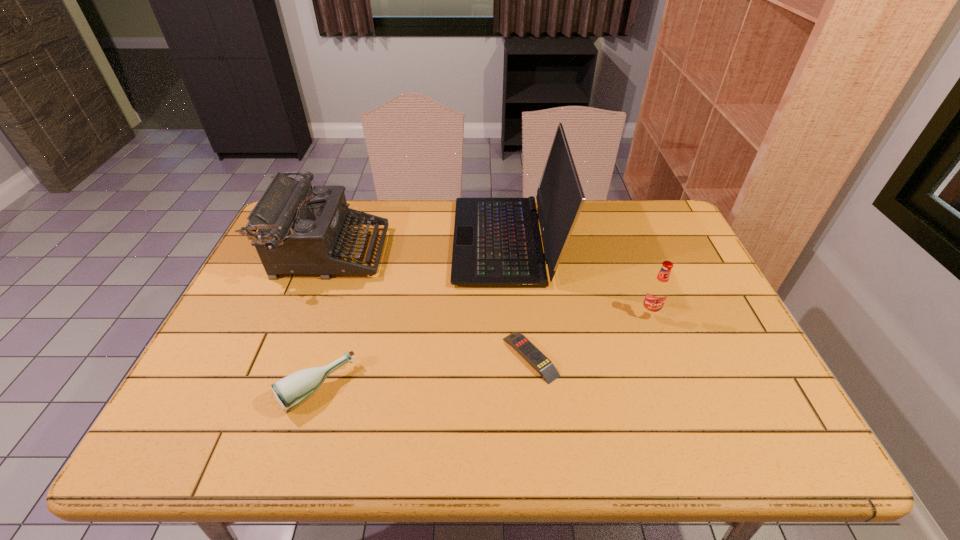
Identify the location of vacant space located 0.230m on the front of the third shortest object. (681, 398).

You are a GUI agent. You are given a task and a screenshot of the screen. Output one action in this format:
    pyautogui.click(x=<x>, y=<y>)
    Task: Click on the vacant space located on the back of the fourth tallest object
    The width and height of the screenshot is (960, 540).
    Given the screenshot: What is the action you would take?
    coord(355,265)

You are a GUI agent. You are given a task and a screenshot of the screen. Output one action in this format:
    pyautogui.click(x=<x>, y=<y>)
    Task: Click on the vacant space located on the front of the remote control
    The width and height of the screenshot is (960, 540).
    Given the screenshot: What is the action you would take?
    pyautogui.click(x=538, y=429)

Find the location of a particular element. Image resolution: width=960 pixels, height=540 pixels. laptop computer that is at the far edge is located at coordinates (497, 243).

The image size is (960, 540). Find the location of `typewriter present at the far edge`. typewriter present at the far edge is located at coordinates (301, 229).

The width and height of the screenshot is (960, 540). Identify the location of object present at the near edge. (291, 391).

Locate an element on the screen. Image resolution: width=960 pixels, height=540 pixels. object that is at the left edge is located at coordinates (301, 229).

The image size is (960, 540). Find the location of `object that is at the far left corner`. object that is at the far left corner is located at coordinates (301, 229).

Locate an element on the screen. free space at the far edge is located at coordinates coord(624,213).

You are a GUI agent. You are given a task and a screenshot of the screen. Output one action in this format:
    pyautogui.click(x=<x>, y=<y>)
    Task: Click on the vacant space at the near edge of the desktop
    This screenshot has height=540, width=960.
    Given the screenshot: What is the action you would take?
    pyautogui.click(x=516, y=418)